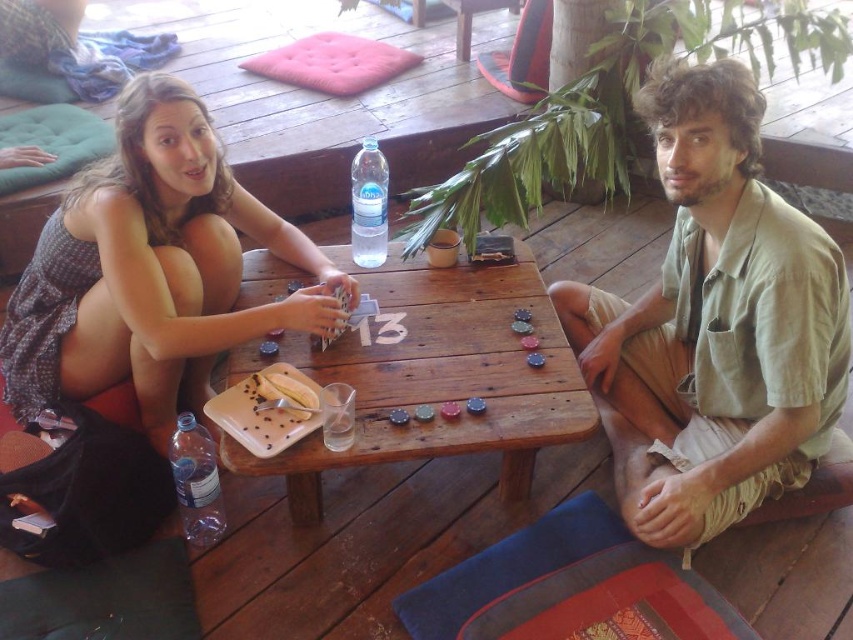
Question: Is matte black dress at upper left closer to camera compared to wooden table at center?

Choices:
 (A) yes
 (B) no

Answer: (B)

Question: Which object is the farthest from the transparent plastic water bottle at center?

Choices:
 (A) green cotton shirt at upper right
 (B) wooden table at center
 (C) transparent plastic bottle at lower left
 (D) matte black dress at upper left

Answer: (A)

Question: Which object is farther from the camera taking this photo?

Choices:
 (A) transparent plastic bottle at lower left
 (B) wooden table at center
 (C) green cotton shirt at upper right
 (D) transparent plastic water bottle at center

Answer: (D)

Question: Which point is closer to the camera?

Choices:
 (A) matte black dress at upper left
 (B) wooden table at center
 (C) green cotton shirt at upper right

Answer: (C)

Question: Is green cotton shirt at upper right to the right of wooden table at center from the viewer's perspective?

Choices:
 (A) yes
 (B) no

Answer: (A)

Question: Can you confirm if matte black dress at upper left is thinner than transparent plastic bottle at lower left?

Choices:
 (A) no
 (B) yes

Answer: (A)